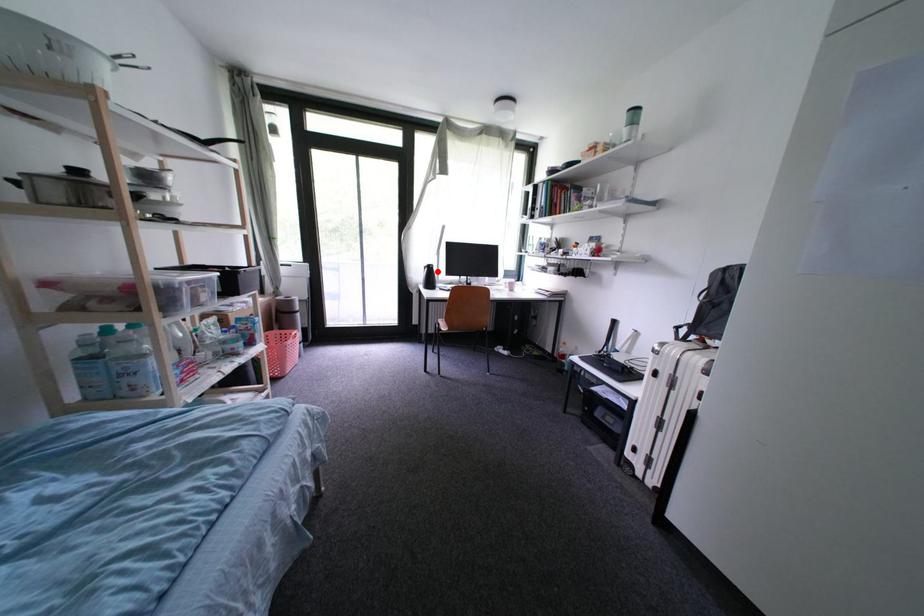
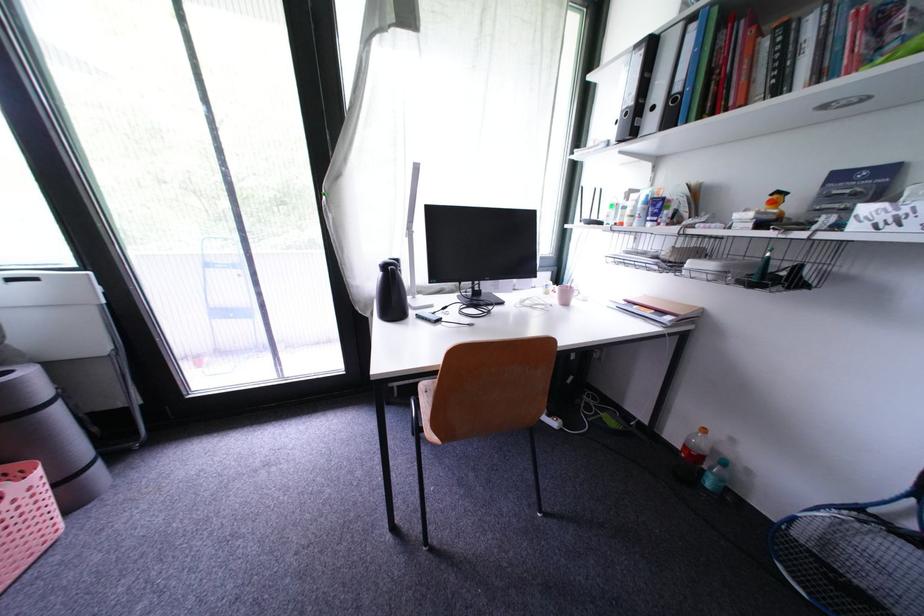
In the second image, find the point that corresponds to the highlighted location in the first image.

(398, 274)